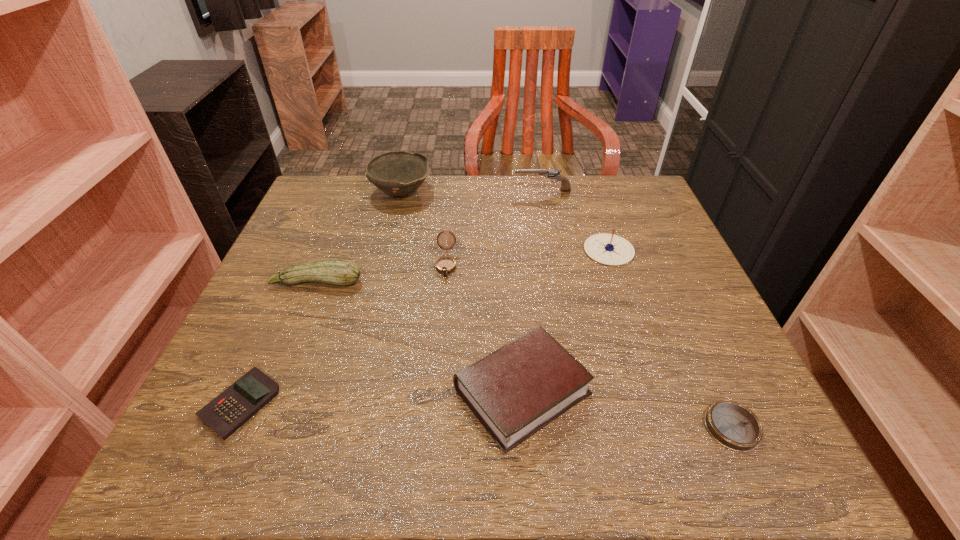
The image size is (960, 540). Find the location of `the second closest compass relative to the zucchini`. the second closest compass relative to the zucchini is located at coordinates (609, 249).

Where is `blank space that satisfies the following two spatial constraints: 1. on the front side of the bowl; 2. on the right side of the second compass from left to right`? This screenshot has height=540, width=960. blank space that satisfies the following two spatial constraints: 1. on the front side of the bowl; 2. on the right side of the second compass from left to right is located at coordinates (386, 250).

In order to click on free spot that satisfies the following two spatial constraints: 1. on the back side of the second compass from right to left; 2. aiming along the barrel of the gun in this screenshot , I will do `click(588, 190)`.

The width and height of the screenshot is (960, 540). I want to click on vacant space that satisfies the following two spatial constraints: 1. on the back side of the bowl; 2. on the left side of the calculator, so click(334, 192).

The width and height of the screenshot is (960, 540). What are the coordinates of `free point that satisfies the following two spatial constraints: 1. on the back side of the second compass from left to right; 2. on the right side of the calculator` in the screenshot? It's located at pyautogui.click(x=308, y=250).

Image resolution: width=960 pixels, height=540 pixels. What are the coordinates of `free spot that satisfies the following two spatial constraints: 1. on the face of the nearest compass; 2. on the left side of the leftmost compass` in the screenshot? It's located at (433, 427).

Identify the location of vacant point that satisfies the following two spatial constraints: 1. aiming along the barrel of the gun; 2. on the left side of the second compass from right to left. (554, 250).

Locate an element on the screen. Image resolution: width=960 pixels, height=540 pixels. free space in the image that satisfies the following two spatial constraints: 1. aiming along the barrel of the second compass from left to right; 2. on the right side of the gun is located at coordinates (554, 250).